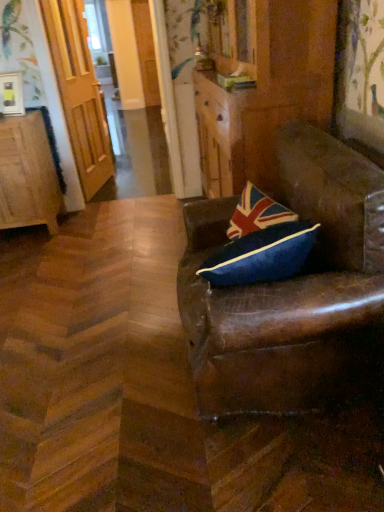
Question: Considering the relative sizes of wooden door at left and brown leather chair at right in the image provided, is wooden door at left wider than brown leather chair at right?

Choices:
 (A) no
 (B) yes

Answer: (A)

Question: Is wooden door at left not near brown leather chair at right?

Choices:
 (A) no
 (B) yes

Answer: (B)

Question: Is wooden door at left positioned in front of brown leather chair at right?

Choices:
 (A) no
 (B) yes

Answer: (A)

Question: Considering the relative sizes of wooden door at left and brown leather chair at right in the image provided, is wooden door at left shorter than brown leather chair at right?

Choices:
 (A) no
 (B) yes

Answer: (A)

Question: From the image's perspective, is wooden door at left over brown leather chair at right?

Choices:
 (A) yes
 (B) no

Answer: (A)

Question: Is the surface of wooden door at left in direct contact with brown leather chair at right?

Choices:
 (A) no
 (B) yes

Answer: (A)

Question: Considering the relative sizes of brown leather chair at right and wooden cabinet at left in the image provided, is brown leather chair at right bigger than wooden cabinet at left?

Choices:
 (A) yes
 (B) no

Answer: (A)

Question: From a real-world perspective, is brown leather chair at right on wooden cabinet at left?

Choices:
 (A) no
 (B) yes

Answer: (B)

Question: Considering the relative sizes of brown leather chair at right and wooden cabinet at left in the image provided, is brown leather chair at right shorter than wooden cabinet at left?

Choices:
 (A) no
 (B) yes

Answer: (A)

Question: From the image's perspective, is brown leather chair at right under wooden cabinet at left?

Choices:
 (A) yes
 (B) no

Answer: (A)

Question: Does brown leather chair at right lie behind wooden cabinet at left?

Choices:
 (A) yes
 (B) no

Answer: (B)

Question: Does brown leather chair at right have a greater width compared to wooden cabinet at left?

Choices:
 (A) yes
 (B) no

Answer: (A)

Question: Is brown leather chair at right facing away from wooden door at left?

Choices:
 (A) no
 (B) yes

Answer: (A)